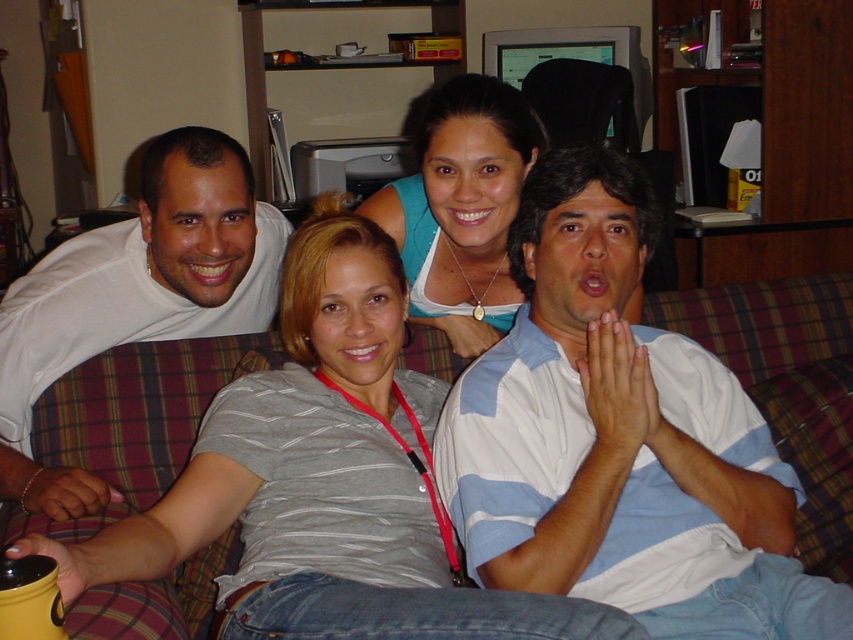
You are a photographer setting up a camera to take a group photo of the white matte shirt at upper left and the matte blue tank top at center. Since you want both subjects to appear the same height in the photo, which subject should you position closer to the camera?

You should position the matte blue tank top at center closer to the camera because the white matte shirt at upper left is taller than the matte blue tank top at center, so moving the shorter one forward will balance their heights in the photo.

Consider the image. You are a photographer setting up a shoot in this living room. You need to position a light source so that it illuminates the white matte shirt at upper left and the matte blue tank top at center without causing harsh shadows. Considering their positions, which direction should you place the light relative to the two subjects?

The white matte shirt at upper left is below the matte blue tank top at center. To avoid harsh shadows, the light should be placed above both subjects, ensuring it reaches both the lower positioned white matte shirt at upper left and the higher positioned matte blue tank top at center evenly.

Based on the photo, you are a photographer setting up a shoot in a living room. You have two subjects wearing white striped shirt at center and white matte shirt at upper left. You want to ensure that the subject with the taller clothing item is placed in the foreground for better visibility. Which subject should you position closer to the camera?

The white striped shirt at center should be positioned closer to the camera since it has a greater height compared to the white matte shirt at upper left, ensuring the taller clothing item is in the foreground for better visibility.